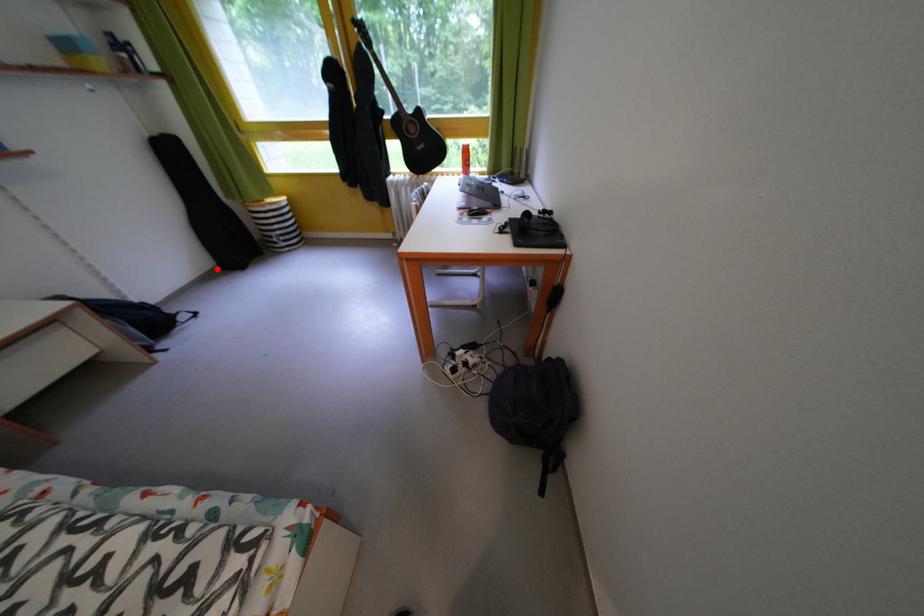
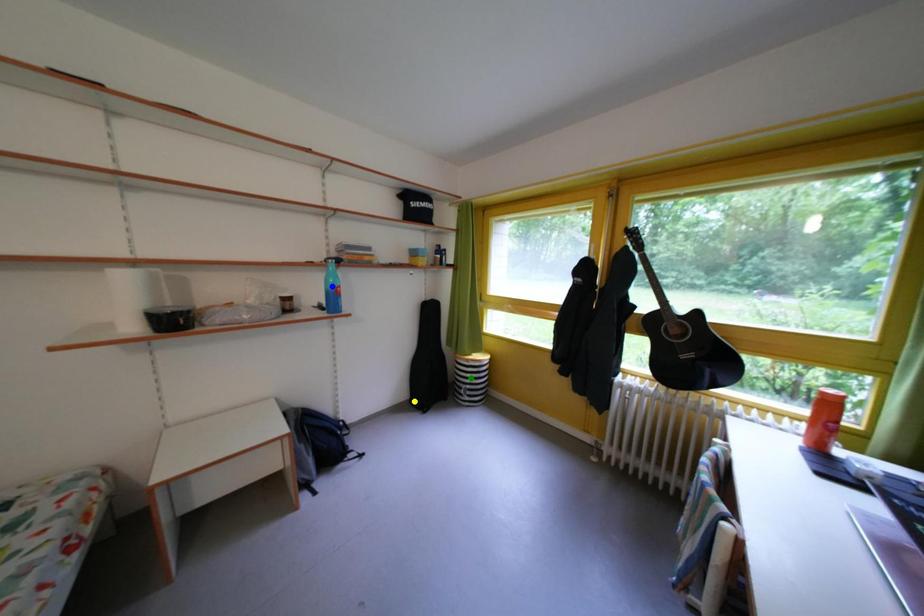
Question: I am providing you with two images of the same scene from different viewpoints. A red point is marked on the first image. You are given multiple points on the second image. Which spot in image 2 lines up with the point in image 1?

Choices:
 (A) blue point
 (B) green point
 (C) yellow point

Answer: (C)